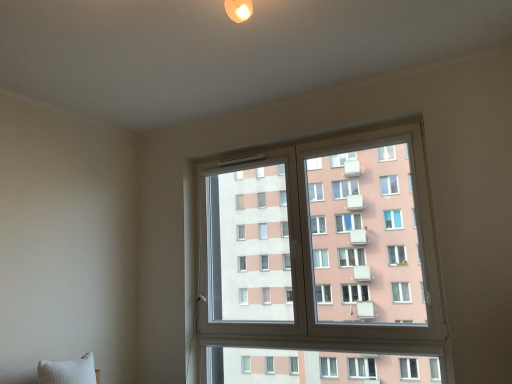
Question: Considering their positions, is transparent glass window at center located in front of or behind white textured pillow at lower left?

Choices:
 (A) front
 (B) behind

Answer: (B)

Question: Does point (254, 167) appear closer or farther from the camera than point (88, 362)?

Choices:
 (A) closer
 (B) farther

Answer: (B)

Question: From the image's perspective, is transparent glass window at center located above or below white textured pillow at lower left?

Choices:
 (A) below
 (B) above

Answer: (B)

Question: Considering the positions of point (90, 375) and point (344, 331), is point (90, 375) closer or farther from the camera than point (344, 331)?

Choices:
 (A) farther
 (B) closer

Answer: (B)

Question: In the image, is white textured pillow at lower left on the left side or the right side of transparent glass window at center?

Choices:
 (A) left
 (B) right

Answer: (A)

Question: Relative to transparent glass window at center, is white textured pillow at lower left in front or behind?

Choices:
 (A) behind
 (B) front

Answer: (B)

Question: Is white textured pillow at lower left wider or thinner than transparent glass window at center?

Choices:
 (A) thin
 (B) wide

Answer: (B)